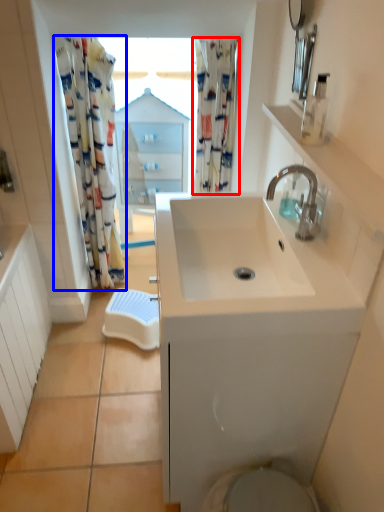
Question: Which point is further to the camera, shower curtain (highlighted by a red box) or shower curtain (highlighted by a blue box)?

Choices:
 (A) shower curtain
 (B) shower curtain

Answer: (A)